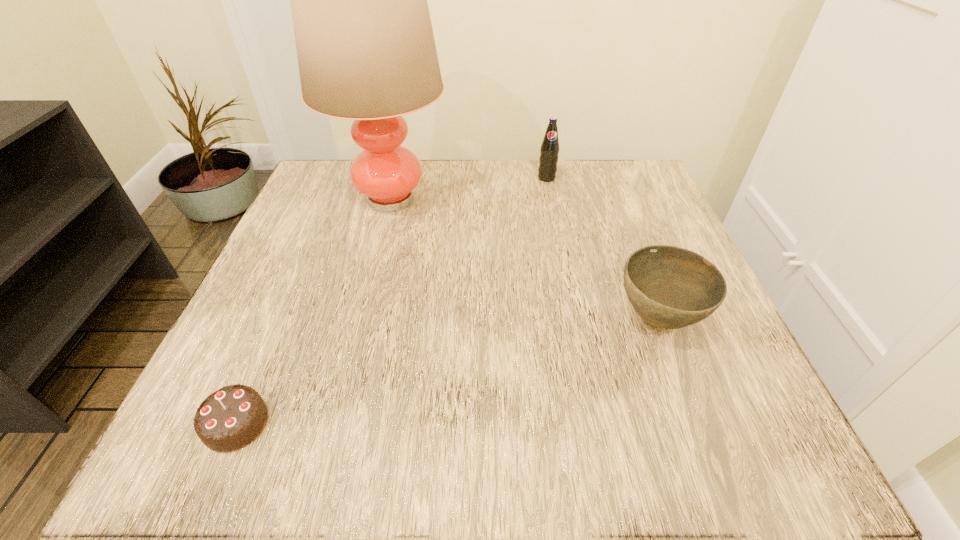
In order to click on the tallest object in this screenshot , I will do `click(366, 52)`.

The image size is (960, 540). Find the location of `the second tallest object`. the second tallest object is located at coordinates (549, 150).

The width and height of the screenshot is (960, 540). In order to click on pop in this screenshot , I will do `click(549, 150)`.

You are a GUI agent. You are given a task and a screenshot of the screen. Output one action in this format:
    pyautogui.click(x=<x>, y=<y>)
    Task: Click on the third tallest object
    The width and height of the screenshot is (960, 540).
    Given the screenshot: What is the action you would take?
    pyautogui.click(x=669, y=287)

The image size is (960, 540). Find the location of `the rightmost object`. the rightmost object is located at coordinates (669, 287).

Where is `the nearest object`? the nearest object is located at coordinates (229, 419).

You are a GUI agent. You are given a task and a screenshot of the screen. Output one action in this format:
    pyautogui.click(x=<x>, y=<y>)
    Task: Click on the shortest object
    
    Given the screenshot: What is the action you would take?
    pyautogui.click(x=229, y=419)

Identify the location of free space located 0.270m on the front of the lamp. (355, 343).

At what (x,y) coordinates should I click in order to perform the action: click on vacant space located 0.290m on the front label of the pop. Please return your answer as a coordinate pair (x, y). This screenshot has width=960, height=540. Looking at the image, I should click on (564, 267).

This screenshot has width=960, height=540. Identify the location of blank space located on the front of the bowl. (684, 389).